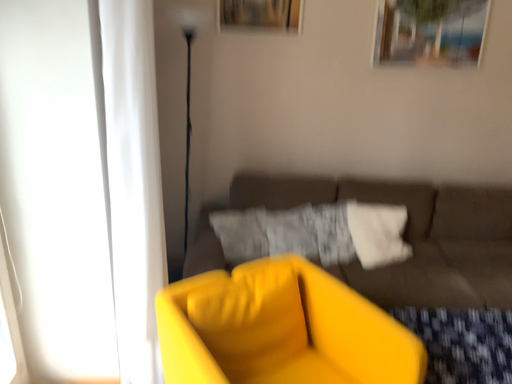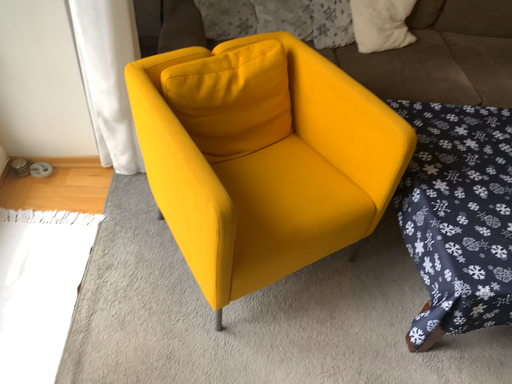
Question: Which way did the camera rotate in the video?

Choices:
 (A) rotated downward
 (B) rotated upward

Answer: (A)